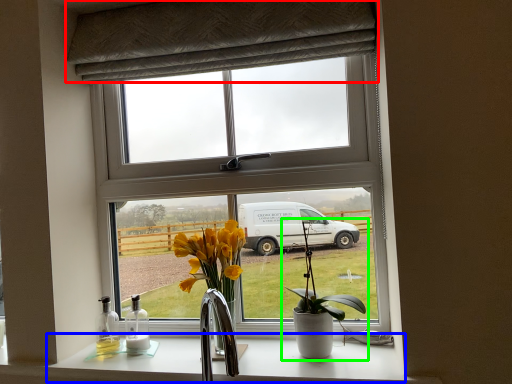
Question: Which is farther away from curtain (highlighted by a red box)? counter top (highlighted by a blue box) or houseplant (highlighted by a green box)?

Choices:
 (A) counter top
 (B) houseplant

Answer: (A)